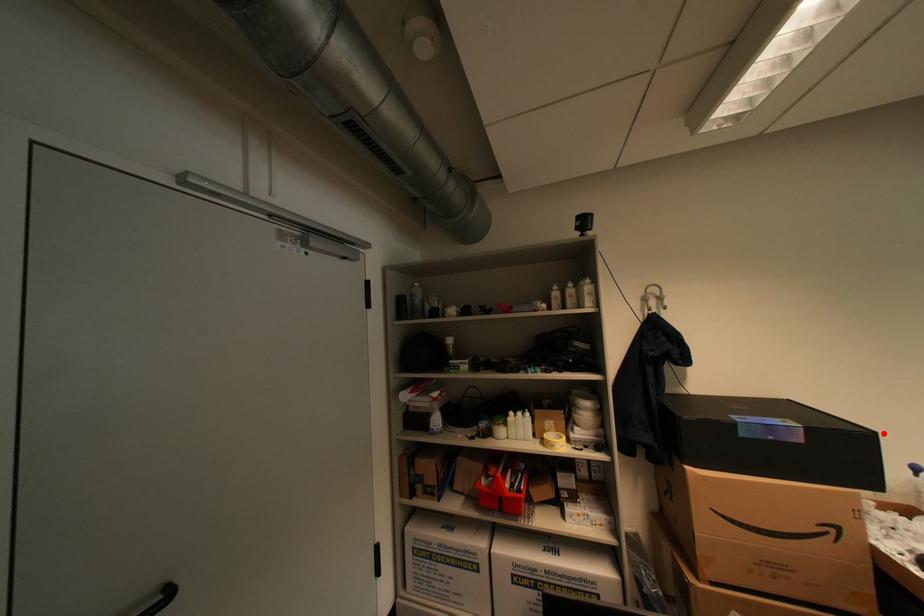
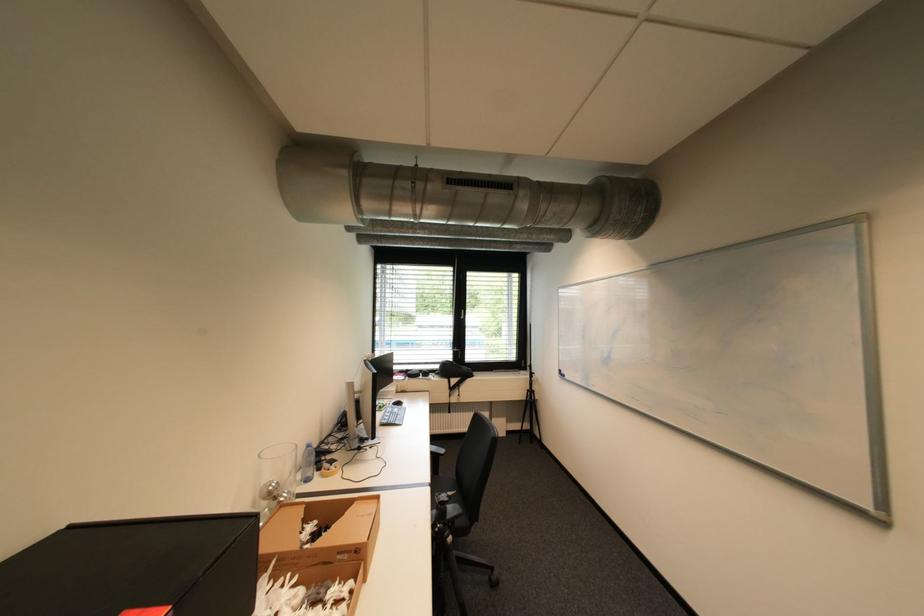
Question: I am providing you with two images of the same scene from different viewpoints. Image1 has a red point marked. In image2, the corresponding 3D location appears at what relative position? Reply with the corresponding letter.

Choices:
 (A) Closer
 (B) Farther

Answer: (A)